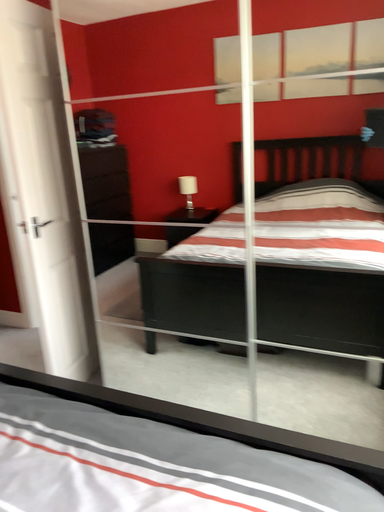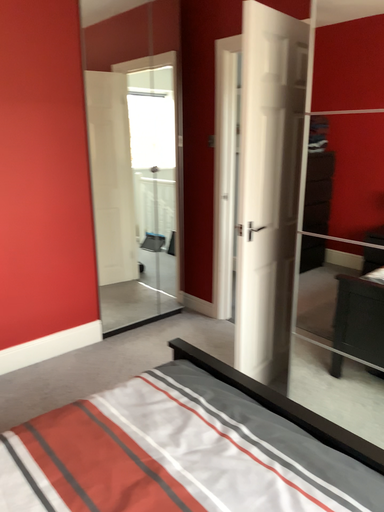
Question: Which way did the camera rotate in the video?

Choices:
 (A) rotated left
 (B) rotated right

Answer: (A)